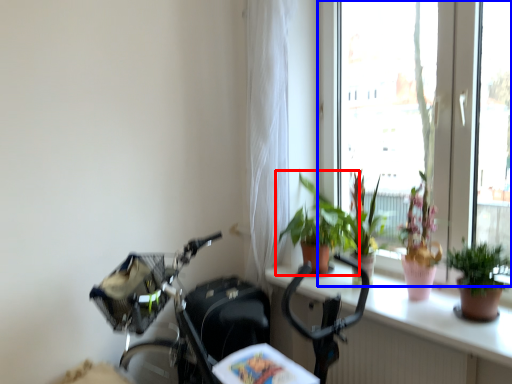
Question: Which object appears farthest to the camera in this image, houseplant (highlighted by a red box) or window (highlighted by a blue box)?

Choices:
 (A) houseplant
 (B) window

Answer: (A)